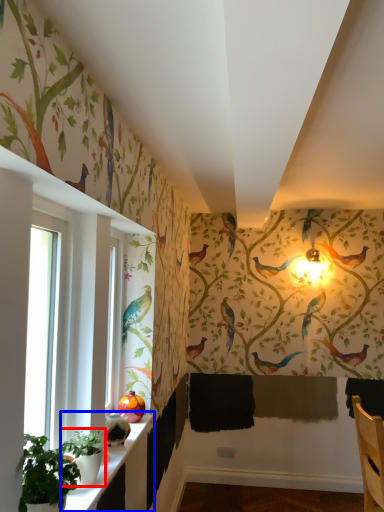
Question: Among these objects, which one is farthest to the camera, plant (highlighted by a red box) or window sill (highlighted by a blue box)?

Choices:
 (A) plant
 (B) window sill

Answer: (A)